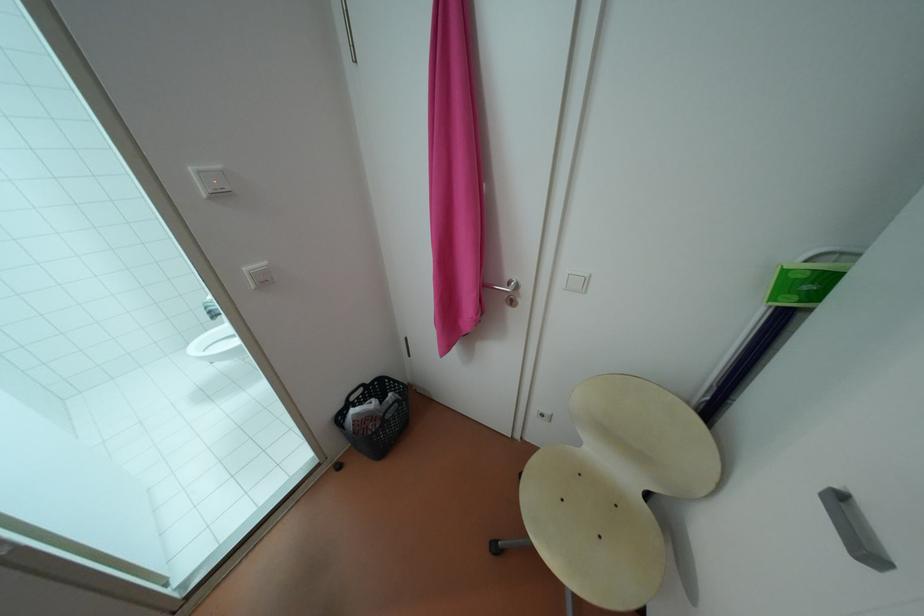
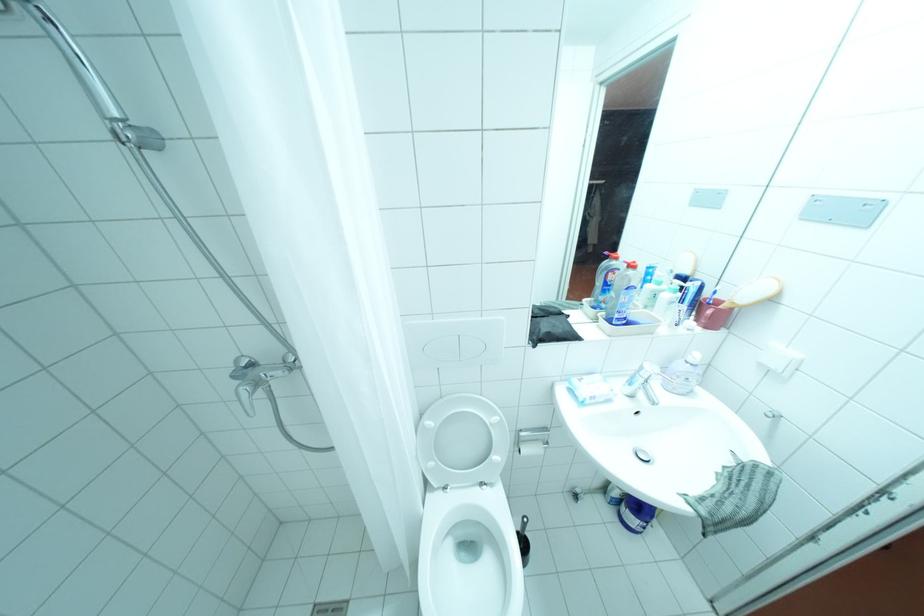
Question: I am providing you with two images of the same scene from different viewpoints. Please identify which objects are invisible in image2.

Choices:
 (A) toilet brush handle
 (B) chair handle cutout
 (C) sink faucet handle
 (D) silver door handle

Answer: (D)